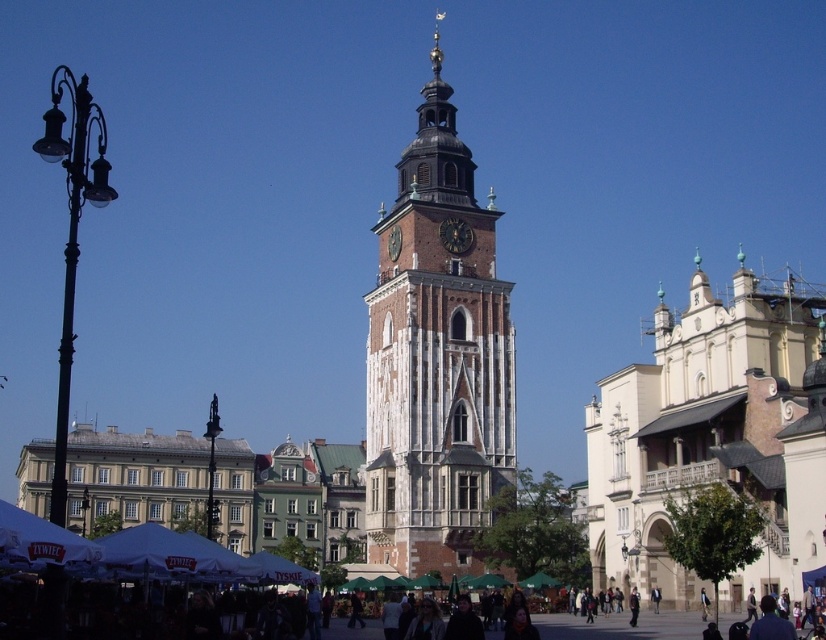
You are an architect analyzing the urban layout of this historic area. You notice the white stone church at right and the dark brown stone clock at center. Which structure has a greater vertical height?

The white stone church at right is taller than the dark brown stone clock at center.

You are an architect analyzing the urban layout. Given that the stone clock tower at center and the dark brown stone clock at center are both central landmarks, which one is taller?

The stone clock tower at center is taller than the dark brown stone clock at center.

Based on the photo, you are standing in front of the historic clock tower and want to take a photo. You notice two points of interest marked as coordinates in the scene. The first point is at location point [639,548] and the second is at point [459,237]. Which point is closer to you when you are facing the clock tower?

Point [639,548] is closer to the camera than point [459,237], so the first point is closer to you when facing the clock tower.